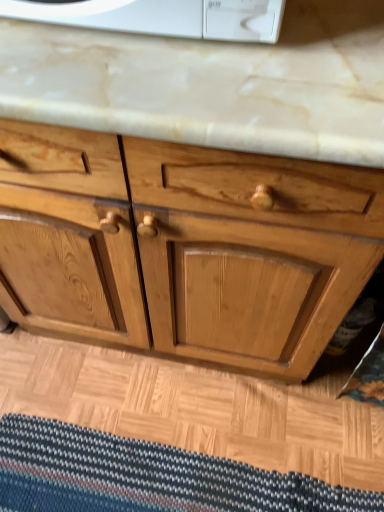
Question: Considering the relative sizes of light brown wood chest of drawers at center and striped fabric doormat at lower center in the image provided, is light brown wood chest of drawers at center wider than striped fabric doormat at lower center?

Choices:
 (A) no
 (B) yes

Answer: (B)

Question: From the image's perspective, is light brown wood chest of drawers at center beneath striped fabric doormat at lower center?

Choices:
 (A) yes
 (B) no

Answer: (B)

Question: Is light brown wood chest of drawers at center at the right side of striped fabric doormat at lower center?

Choices:
 (A) yes
 (B) no

Answer: (A)

Question: Is light brown wood chest of drawers at center closer to camera compared to striped fabric doormat at lower center?

Choices:
 (A) no
 (B) yes

Answer: (B)

Question: Is light brown wood chest of drawers at center positioned with its back to striped fabric doormat at lower center?

Choices:
 (A) no
 (B) yes

Answer: (A)

Question: From a real-world perspective, is light brown wood chest of drawers at center below striped fabric doormat at lower center?

Choices:
 (A) no
 (B) yes

Answer: (A)

Question: Is striped fabric doormat at lower center outside of light brown wood chest of drawers at center?

Choices:
 (A) no
 (B) yes

Answer: (B)

Question: Would you say striped fabric doormat at lower center is a long distance from light brown wood chest of drawers at center?

Choices:
 (A) yes
 (B) no

Answer: (B)

Question: From a real-world perspective, is striped fabric doormat at lower center on light brown wood chest of drawers at center?

Choices:
 (A) no
 (B) yes

Answer: (A)

Question: Is striped fabric doormat at lower center positioned with its back to light brown wood chest of drawers at center?

Choices:
 (A) no
 (B) yes

Answer: (B)

Question: Is striped fabric doormat at lower center taller than light brown wood chest of drawers at center?

Choices:
 (A) no
 (B) yes

Answer: (A)

Question: Can you confirm if striped fabric doormat at lower center is positioned to the right of light brown wood chest of drawers at center?

Choices:
 (A) no
 (B) yes

Answer: (A)

Question: From the image's perspective, is striped fabric doormat at lower center located above or below light brown wood chest of drawers at center?

Choices:
 (A) above
 (B) below

Answer: (B)